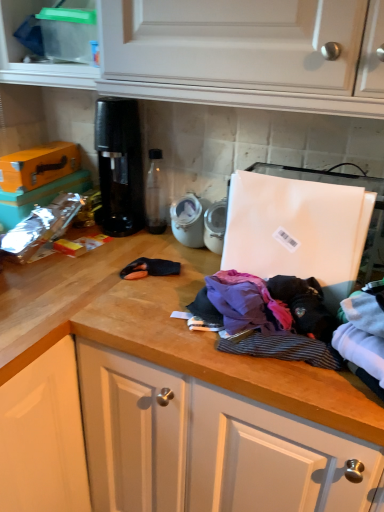
Find the location of `purple cotton shirt at center, the 2th clothing when ordered from right to left`. purple cotton shirt at center, the 2th clothing when ordered from right to left is located at coordinates (304, 305).

Measure the distance between point (256,325) and camera.

They are 89.50 centimeters apart.

What do you see at coordinates (246, 303) in the screenshot? The width and height of the screenshot is (384, 512). I see `purple fabric at center, which is the fourth clothing in right-to-left order` at bounding box center [246, 303].

In order to click on white cotton socks at lower right, placed as the first clothing when sorted from right to left in this screenshot , I will do `click(364, 335)`.

Find the location of `purple cotton shirt at center, the 2th clothing when ordered from right to left`. purple cotton shirt at center, the 2th clothing when ordered from right to left is located at coordinates (304, 305).

From their relative heights in the image, would you say clear plastic container at upper left is taller or shorter than striped cotton shirt at center, placed as the 3th clothing when sorted from right to left?

Considering their sizes, clear plastic container at upper left has more height than striped cotton shirt at center, placed as the 3th clothing when sorted from right to left.

Does point (61, 72) lie behind point (235, 350)?

Yes, point (61, 72) is behind point (235, 350).

In the scene shown: Considering the relative positions of clear plastic container at upper left and striped cotton shirt at center, placed as the 3th clothing when sorted from right to left, in the image provided, is clear plastic container at upper left to the left of striped cotton shirt at center, placed as the 3th clothing when sorted from right to left, from the viewer's perspective?

Yes, clear plastic container at upper left is to the left of striped cotton shirt at center, placed as the 3th clothing when sorted from right to left.

Does clear plastic container at upper left turn towards striped cotton shirt at center, placed as the 3th clothing when sorted from right to left?

No, clear plastic container at upper left is not oriented towards striped cotton shirt at center, placed as the 3th clothing when sorted from right to left.

The width and height of the screenshot is (384, 512). Find the location of `clothing that is the 1st object located below the purple cotton shirt at center, the 2th clothing when ordered from right to left (from the image's perspective)`. clothing that is the 1st object located below the purple cotton shirt at center, the 2th clothing when ordered from right to left (from the image's perspective) is located at coordinates (269, 317).

Between purple cotton shirt at center, the 2th clothing when ordered from right to left, and striped cotton shirt at center, placed as the 3th clothing when sorted from right to left, which one has larger size?

Bigger between the two is striped cotton shirt at center, placed as the 3th clothing when sorted from right to left.

Considering the positions of objects purple cotton shirt at center, the 2th clothing when ordered from right to left, and striped cotton shirt at center, placed as the 3th clothing when sorted from right to left, in the image provided, who is more to the left, purple cotton shirt at center, the 2th clothing when ordered from right to left, or striped cotton shirt at center, placed as the 3th clothing when sorted from right to left,?

striped cotton shirt at center, placed as the 3th clothing when sorted from right to left.

How many degrees apart are the facing directions of purple cotton shirt at center, the 2th clothing when ordered from right to left, and striped cotton shirt at center, which ranks as the second clothing in left-to-right order?

They differ by 0.00243 degrees in their facing directions.

Considering the sizes of objects white cotton socks at lower right, placed as the first clothing when sorted from right to left, and purple fabric at center, which is the fourth clothing in right-to-left order, in the image provided, who is taller, white cotton socks at lower right, placed as the first clothing when sorted from right to left, or purple fabric at center, which is the fourth clothing in right-to-left order,?

Standing taller between the two is white cotton socks at lower right, placed as the first clothing when sorted from right to left.

Is white cotton socks at lower right, placed as the first clothing when sorted from right to left, bigger than purple fabric at center, which is the fourth clothing in right-to-left order?

Correct, white cotton socks at lower right, placed as the first clothing when sorted from right to left, is larger in size than purple fabric at center, which is the fourth clothing in right-to-left order.

Which is behind, white cotton socks at lower right, which ranks as the 4th clothing in left-to-right order, or purple fabric at center, which is the first clothing in left-to-right order?

purple fabric at center, which is the first clothing in left-to-right order, is behind.

Which object is positioned more to the right, white cotton socks at lower right, which ranks as the 4th clothing in left-to-right order, or purple fabric at center, which is the first clothing in left-to-right order?

white cotton socks at lower right, which ranks as the 4th clothing in left-to-right order, is more to the right.

Considering the relative sizes of striped cotton shirt at center, which ranks as the second clothing in left-to-right order, and black plastic coffee machine at center in the image provided, is striped cotton shirt at center, which ranks as the second clothing in left-to-right order, smaller than black plastic coffee machine at center?

Indeed, striped cotton shirt at center, which ranks as the second clothing in left-to-right order, has a smaller size compared to black plastic coffee machine at center.

Which object is closer to the camera taking this photo, striped cotton shirt at center, which ranks as the second clothing in left-to-right order, or black plastic coffee machine at center?

Positioned in front is striped cotton shirt at center, which ranks as the second clothing in left-to-right order.

Is striped cotton shirt at center, placed as the 3th clothing when sorted from right to left, located outside black plastic coffee machine at center?

Yes, striped cotton shirt at center, placed as the 3th clothing when sorted from right to left, is located beyond the bounds of black plastic coffee machine at center.

Which of these two, striped cotton shirt at center, which ranks as the second clothing in left-to-right order, or purple fabric at center, which is the first clothing in left-to-right order, is smaller?

purple fabric at center, which is the first clothing in left-to-right order, is smaller.

Considering the sizes of objects striped cotton shirt at center, which ranks as the second clothing in left-to-right order, and purple fabric at center, which is the first clothing in left-to-right order, in the image provided, who is taller, striped cotton shirt at center, which ranks as the second clothing in left-to-right order, or purple fabric at center, which is the first clothing in left-to-right order,?

With more height is purple fabric at center, which is the first clothing in left-to-right order.

Which is less distant, (331, 314) or (248, 277)?

The point (331, 314) is closer.

In order to click on the 2nd clothing in front of the purple fabric at center, which is the fourth clothing in right-to-left order, starting your count from the anchor in this screenshot , I will do `click(269, 317)`.

Looking at this image, from a real-world perspective, is striped cotton shirt at center, which ranks as the second clothing in left-to-right order, physically located above or below purple cotton shirt at center, arranged as the third clothing when viewed from the left?

Clearly, from a real-world perspective, striped cotton shirt at center, which ranks as the second clothing in left-to-right order, is below purple cotton shirt at center, arranged as the third clothing when viewed from the left.

Is striped cotton shirt at center, placed as the 3th clothing when sorted from right to left, facing away from purple cotton shirt at center, arranged as the third clothing when viewed from the left?

striped cotton shirt at center, placed as the 3th clothing when sorted from right to left, does not have its back to purple cotton shirt at center, arranged as the third clothing when viewed from the left.

Consider the image. Which of these two, striped cotton shirt at center, placed as the 3th clothing when sorted from right to left, or purple cotton shirt at center, the 2th clothing when ordered from right to left, is smaller?

purple cotton shirt at center, the 2th clothing when ordered from right to left, is smaller.

From the image's perspective, relative to purple cotton shirt at center, arranged as the third clothing when viewed from the left, is striped cotton shirt at center, which ranks as the second clothing in left-to-right order, above or below?

striped cotton shirt at center, which ranks as the second clothing in left-to-right order, is situated lower than purple cotton shirt at center, arranged as the third clothing when viewed from the left, in the image.

Is purple cotton shirt at center, arranged as the third clothing when viewed from the left, positioned in front of white cotton socks at lower right, placed as the first clothing when sorted from right to left?

No, it is not.

Does point (313, 313) lie in front of point (356, 327)?

No, (313, 313) is behind (356, 327).

Does purple cotton shirt at center, arranged as the third clothing when viewed from the left, have a smaller size compared to white cotton socks at lower right, which ranks as the 4th clothing in left-to-right order?

Yes.

The width and height of the screenshot is (384, 512). I want to click on the 2nd clothing positioned above the white cotton socks at lower right, which ranks as the 4th clothing in left-to-right order (from the image's perspective), so click(x=304, y=305).

The width and height of the screenshot is (384, 512). I want to click on the 4th clothing positioned below the clear plastic container at upper left (from a real-world perspective), so click(x=269, y=317).

From the image's perspective, which clothing is the 1st one below the purple cotton shirt at center, arranged as the third clothing when viewed from the left? Please provide its 2D coordinates.

[(269, 317)]

Estimate the real-world distances between objects in this image. Which object is further from black plastic coffee machine at center, purple cotton shirt at center, the 2th clothing when ordered from right to left, or purple fabric at center, which is the fourth clothing in right-to-left order?

Among the two, purple cotton shirt at center, the 2th clothing when ordered from right to left, is located further to black plastic coffee machine at center.

Which object lies nearer to the anchor point clear plastic container at upper left, purple fabric at center, which is the fourth clothing in right-to-left order, or white cotton socks at lower right, which ranks as the 4th clothing in left-to-right order?

purple fabric at center, which is the fourth clothing in right-to-left order, is closer to clear plastic container at upper left.

Considering their positions, is purple fabric at center, which is the first clothing in left-to-right order, positioned further to purple cotton shirt at center, arranged as the third clothing when viewed from the left, than clear plastic container at upper left?

clear plastic container at upper left is further to purple cotton shirt at center, arranged as the third clothing when viewed from the left.

Which object lies nearer to the anchor point striped cotton shirt at center, placed as the 3th clothing when sorted from right to left, purple fabric at center, which is the fourth clothing in right-to-left order, or black plastic coffee machine at center?

purple fabric at center, which is the fourth clothing in right-to-left order, is positioned closer to the anchor striped cotton shirt at center, placed as the 3th clothing when sorted from right to left.

When comparing their distances from black plastic coffee machine at center, does purple fabric at center, which is the fourth clothing in right-to-left order, or white cotton socks at lower right, which ranks as the 4th clothing in left-to-right order, seem closer?

purple fabric at center, which is the fourth clothing in right-to-left order.

Looking at the image, which one is located closer to purple cotton shirt at center, arranged as the third clothing when viewed from the left, black plastic coffee machine at center or striped cotton shirt at center, which ranks as the second clothing in left-to-right order?

striped cotton shirt at center, which ranks as the second clothing in left-to-right order, is closer to purple cotton shirt at center, arranged as the third clothing when viewed from the left.

Looking at the image, which one is located closer to white cotton socks at lower right, placed as the first clothing when sorted from right to left, black plastic coffee machine at center or clear plastic container at upper left?

black plastic coffee machine at center is positioned closer to the anchor white cotton socks at lower right, placed as the first clothing when sorted from right to left.

From the image, which object appears to be farther from purple fabric at center, which is the first clothing in left-to-right order, clear plastic container at upper left or white cotton socks at lower right, placed as the first clothing when sorted from right to left?

clear plastic container at upper left is positioned further to the anchor purple fabric at center, which is the first clothing in left-to-right order.

At what (x,y) coordinates should I click in order to perform the action: click on coffee machine that lies between clear plastic container at upper left and purple fabric at center, which is the first clothing in left-to-right order, from top to bottom. Please return your answer as a coordinate pair (x, y). This screenshot has width=384, height=512. Looking at the image, I should click on (119, 165).

Where is `coffee machine located between clear plastic container at upper left and white cotton socks at lower right, placed as the first clothing when sorted from right to left, in the left-right direction`? coffee machine located between clear plastic container at upper left and white cotton socks at lower right, placed as the first clothing when sorted from right to left, in the left-right direction is located at coordinates (119, 165).

Locate an element on the screen. coffee machine that lies between clear plastic container at upper left and purple cotton shirt at center, the 2th clothing when ordered from right to left, from top to bottom is located at coordinates (119, 165).

Identify the location of clothing between clear plastic container at upper left and purple cotton shirt at center, the 2th clothing when ordered from right to left, in the vertical direction. (246, 303).